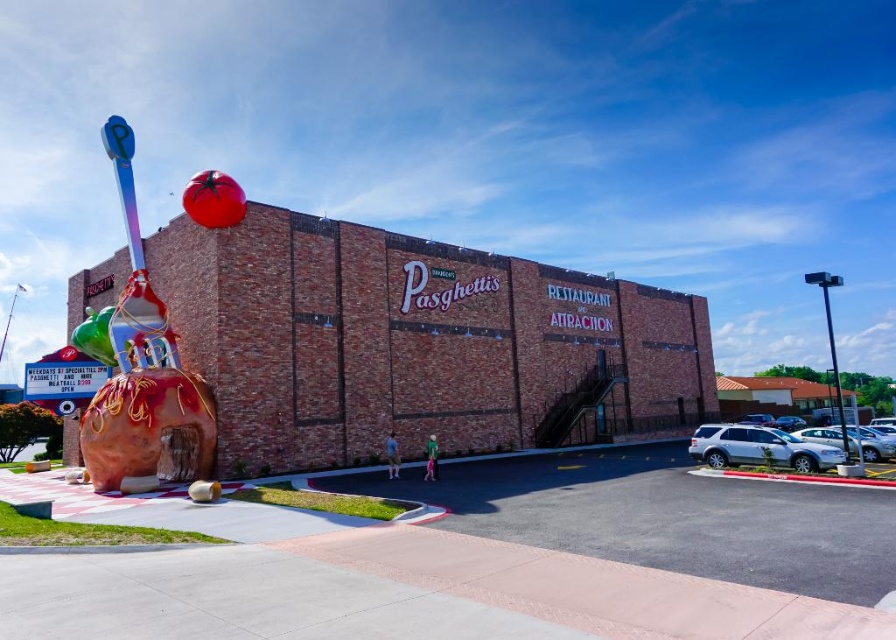
Question: Which object is the farthest from the brick building at center?

Choices:
 (A) shiny metallic spoon at left
 (B) black metal pole at right

Answer: (B)

Question: Can you confirm if brick building at center is thinner than metallic pole at right?

Choices:
 (A) no
 (B) yes

Answer: (B)

Question: Does black metal pole at right have a greater width compared to metallic pole at right?

Choices:
 (A) no
 (B) yes

Answer: (B)

Question: Considering the relative positions of brick building at center and black metal pole at right in the image provided, where is brick building at center located with respect to black metal pole at right?

Choices:
 (A) above
 (B) below

Answer: (B)

Question: Which point appears farthest from the camera in this image?

Choices:
 (A) (401, 404)
 (B) (823, 275)
 (C) (161, 417)

Answer: (A)

Question: Which is nearer to the brick building at center?

Choices:
 (A) black metal pole at right
 (B) shiny metallic spoon at left

Answer: (B)